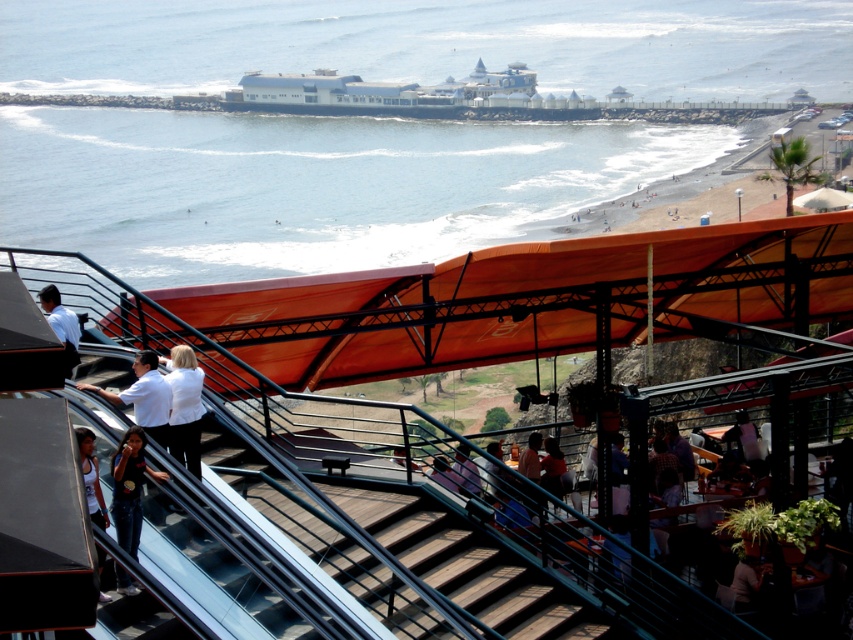
Looking at this image, you are a photographer standing at the top of the modern staircase with black railings and glass panel. You see two people below you at the lower left corner of the scene. One is wearing dark blue jeans at lower left and the other is wearing white jersey at lower left. Which person is positioned more to the right from your viewpoint?

The dark blue jeans at lower left is positioned on the right side of white jersey at lower left, so the person wearing dark blue jeans at lower left is more to the right from your viewpoint.

You are a photographer standing at the top of the staircase and want to take a photo of the dark blue jeans at lower left and the matte white shirt at left. Which object should you zoom in more on to ensure both are clearly visible in the frame?

Since the dark blue jeans at lower left is smaller in size compared to the matte white shirt at left, you should zoom in more on the dark blue jeans at lower left to ensure both are clearly visible in the frame.